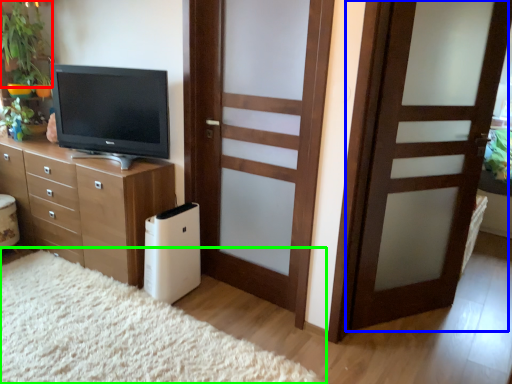
Question: Which is farther away from plant (highlighted by a red box)? door (highlighted by a blue box) or plain (highlighted by a green box)?

Choices:
 (A) door
 (B) plain

Answer: (A)